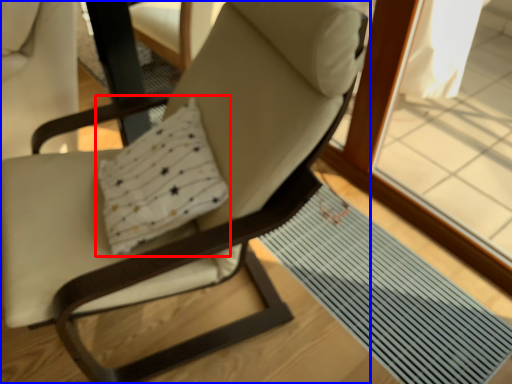
Question: Among these objects, which one is farthest to the camera, pillow (highlighted by a red box) or chair (highlighted by a blue box)?

Choices:
 (A) pillow
 (B) chair

Answer: (A)